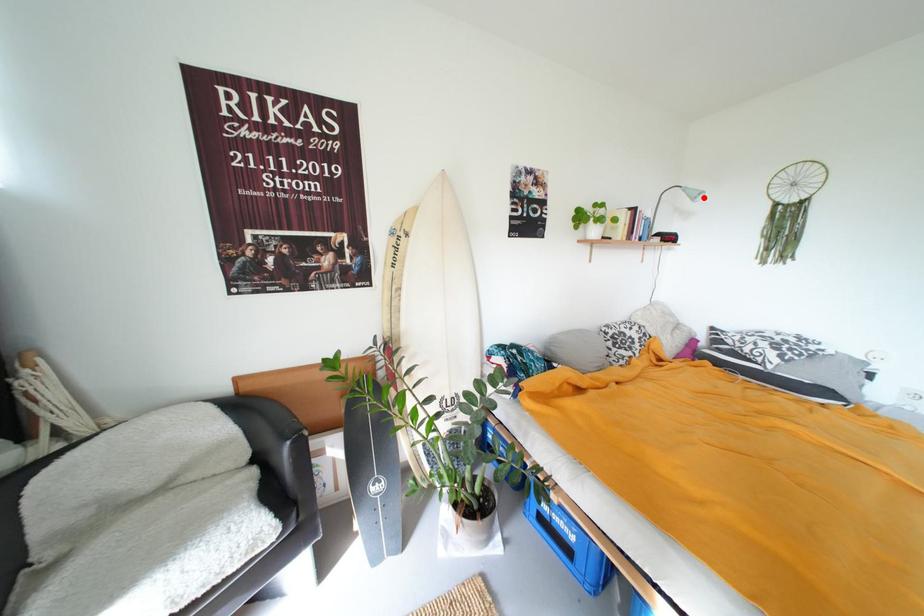
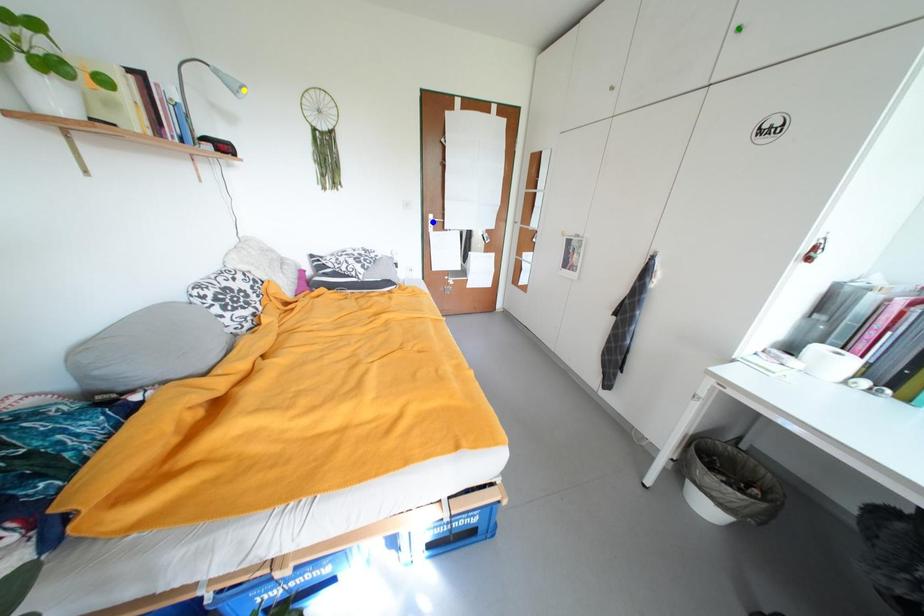
Question: I am providing you with two images of the same scene from different viewpoints. A red point is marked on the first image. You are given multiple points on the second image. In image 2, which mark is for the same physical point as the one in image 1?

Choices:
 (A) blue point
 (B) yellow point
 (C) green point

Answer: (B)